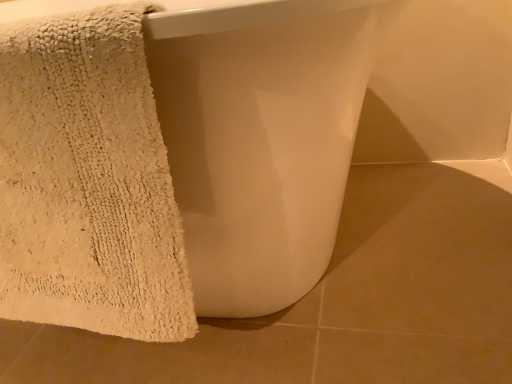
The width and height of the screenshot is (512, 384). Describe the element at coordinates (88, 181) in the screenshot. I see `beige textured towel at left` at that location.

Find the location of a particular element. beige textured towel at left is located at coordinates (88, 181).

Where is `beige textured towel at left`? The image size is (512, 384). beige textured towel at left is located at coordinates (88, 181).